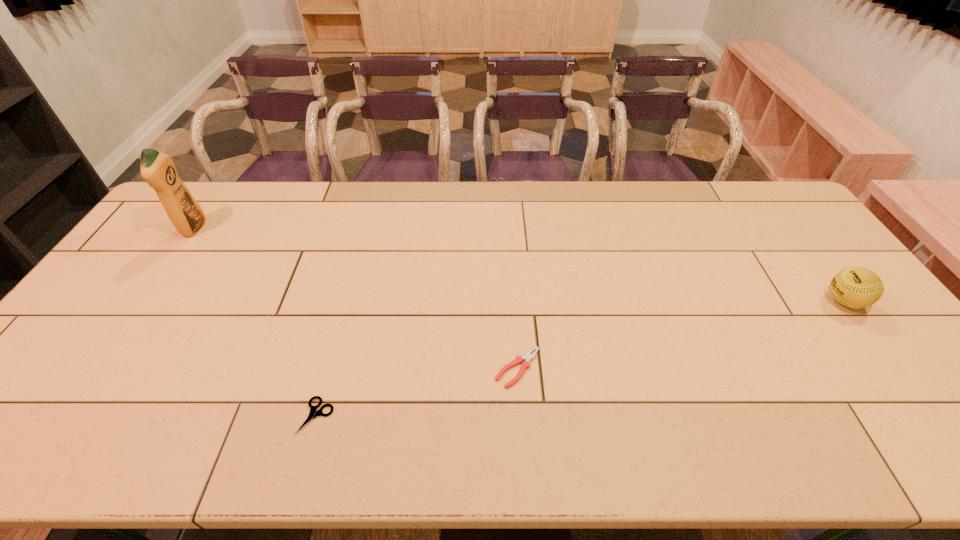
I want to click on vacant region that satisfies the following two spatial constraints: 1. on the label of the shears; 2. on the right side of the detergent, so click(x=62, y=416).

This screenshot has width=960, height=540. Find the location of `free spot that satisfies the following two spatial constraints: 1. on the label of the farthest object; 2. on the right side of the shears`. free spot that satisfies the following two spatial constraints: 1. on the label of the farthest object; 2. on the right side of the shears is located at coordinates (62, 416).

This screenshot has width=960, height=540. What are the coordinates of `vacant space that satisfies the following two spatial constraints: 1. on the label of the farthest object; 2. on the back side of the pliers` in the screenshot? It's located at (96, 368).